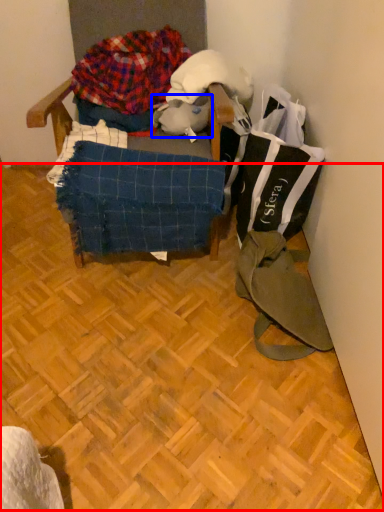
Question: Which object is further to the camera taking this photo, wood (highlighted by a red box) or animal (highlighted by a blue box)?

Choices:
 (A) wood
 (B) animal

Answer: (B)